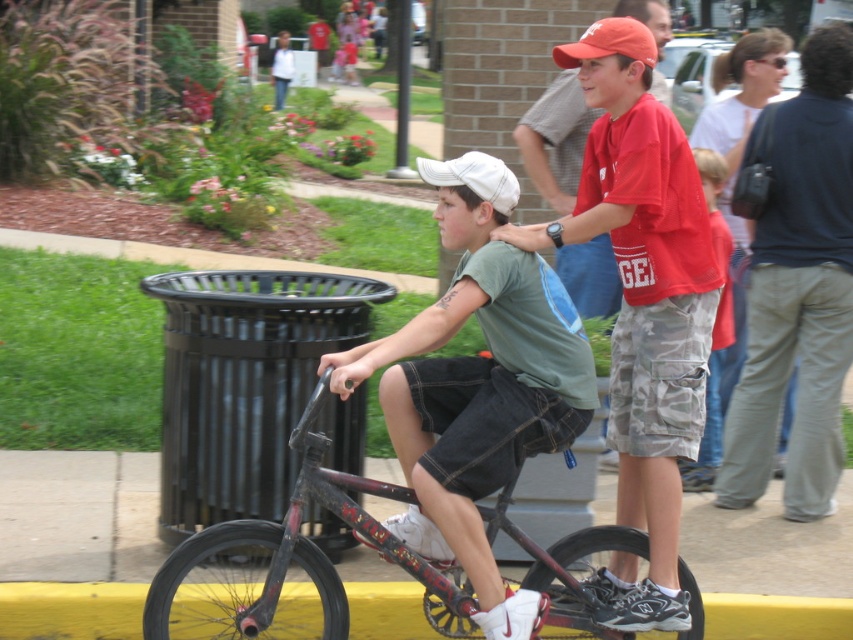
You are a photographer at the event and want to capture a photo that includes both the red cotton shirt at center and the dark blue shirt at upper right. Based on their positions, which shirt should you focus on first to ensure both are in the frame?

You should focus on the red cotton shirt at center first because it is in front of the dark blue shirt at upper right, so capturing the foreground subject first will help ensure both are included in the frame.

Consider the image. You are standing at the point labeled point (x=668, y=93) and want to walk to the point labeled point (x=711, y=280). Which direction should you face to walk directly towards your destination?

You should face forward because point (x=711, y=280) is in front of point (x=668, y=93).